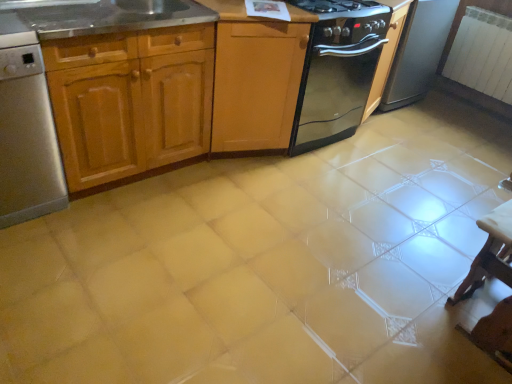
Question: From the image's perspective, is stainless steel dishwasher at left located beneath black glass stove at center?

Choices:
 (A) no
 (B) yes

Answer: (B)

Question: Is stainless steel dishwasher at left completely or partially outside of black glass stove at center?

Choices:
 (A) yes
 (B) no

Answer: (A)

Question: Does stainless steel dishwasher at left have a larger size compared to black glass stove at center?

Choices:
 (A) yes
 (B) no

Answer: (B)

Question: Does stainless steel dishwasher at left have a lesser width compared to black glass stove at center?

Choices:
 (A) no
 (B) yes

Answer: (B)

Question: Is black glass stove at center inside stainless steel dishwasher at left?

Choices:
 (A) yes
 (B) no

Answer: (B)

Question: Based on their sizes in the image, would you say black glass stove at center is bigger or smaller than black glossy oven at upper right?

Choices:
 (A) big
 (B) small

Answer: (B)

Question: Which is correct: black glass stove at center is inside black glossy oven at upper right, or outside of it?

Choices:
 (A) outside
 (B) inside

Answer: (A)

Question: From their relative heights in the image, would you say black glass stove at center is taller or shorter than black glossy oven at upper right?

Choices:
 (A) short
 (B) tall

Answer: (A)

Question: Does point (373, 64) appear closer or farther from the camera than point (392, 64)?

Choices:
 (A) farther
 (B) closer

Answer: (B)

Question: Is white glossy table at lower right inside or outside of stainless steel sink at upper left?

Choices:
 (A) outside
 (B) inside

Answer: (A)

Question: Is white glossy table at lower right bigger or smaller than stainless steel sink at upper left?

Choices:
 (A) small
 (B) big

Answer: (B)

Question: Is white glossy table at lower right in front of or behind stainless steel sink at upper left in the image?

Choices:
 (A) behind
 (B) front

Answer: (B)

Question: Considering the positions of point (484, 274) and point (113, 18), is point (484, 274) closer or farther from the camera than point (113, 18)?

Choices:
 (A) closer
 (B) farther

Answer: (B)

Question: Is point [x=177, y=16] positioned closer to the camera than point [x=301, y=0]?

Choices:
 (A) farther
 (B) closer

Answer: (B)

Question: From a real-world perspective, is stainless steel sink at upper left above or below black glass gas stove at upper center?

Choices:
 (A) above
 (B) below

Answer: (B)